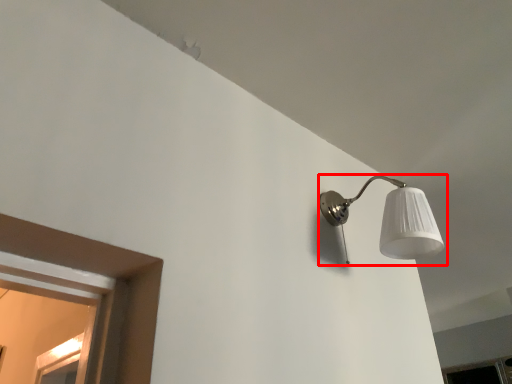
Question: From the image, what is the correct spatial relationship of lamp (annotated by the red box) in relation to window?

Choices:
 (A) left
 (B) right

Answer: (A)